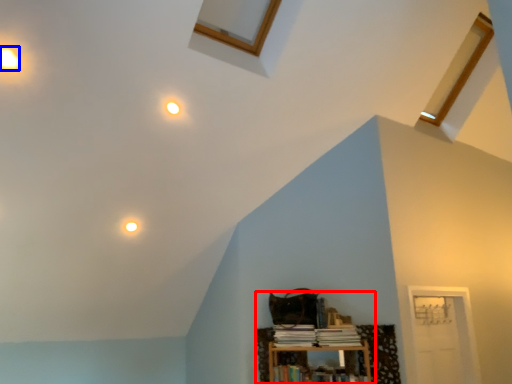
Question: Among these objects, which one is farthest to the camera, bookcase (highlighted by a red box) or dot (highlighted by a blue box)?

Choices:
 (A) bookcase
 (B) dot

Answer: (A)